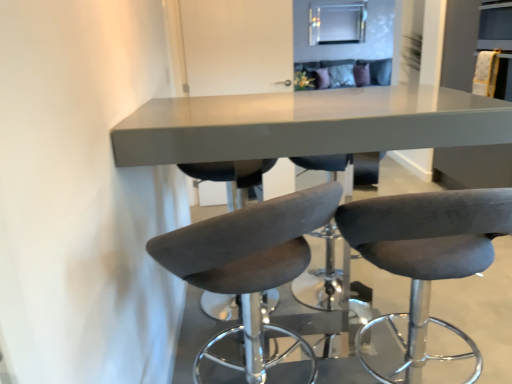
Question: Is dark gray fabric stool at center, arranged as the first chair when viewed from the right, far away from suede-like gray bar stool at center, which ranks as the 2th chair in right-to-left order?

Choices:
 (A) yes
 (B) no

Answer: (B)

Question: Is dark gray fabric stool at center, arranged as the first chair when viewed from the right, oriented away from suede-like gray bar stool at center, which ranks as the 2th chair in right-to-left order?

Choices:
 (A) no
 (B) yes

Answer: (A)

Question: Does dark gray fabric stool at center, arranged as the first chair when viewed from the right, have a lesser height compared to suede-like gray bar stool at center, which ranks as the 2th chair in right-to-left order?

Choices:
 (A) yes
 (B) no

Answer: (A)

Question: Considering the relative sizes of dark gray fabric stool at center, the 2th chair viewed from the left, and suede-like gray bar stool at center, which ranks as the 2th chair in right-to-left order, in the image provided, is dark gray fabric stool at center, the 2th chair viewed from the left, thinner than suede-like gray bar stool at center, which ranks as the 2th chair in right-to-left order,?

Choices:
 (A) no
 (B) yes

Answer: (B)

Question: Would you say suede-like gray bar stool at center, the 1th chair when ordered from left to right, is part of dark gray fabric stool at center, arranged as the first chair when viewed from the right,'s contents?

Choices:
 (A) no
 (B) yes

Answer: (A)

Question: Is dark gray fabric stool at center, arranged as the first chair when viewed from the right, located outside suede-like gray bar stool at center, the 1th chair when ordered from left to right?

Choices:
 (A) no
 (B) yes

Answer: (B)

Question: Does matte gray table at center turn towards suede-like gray bar stool at center, which ranks as the 2th chair in right-to-left order?

Choices:
 (A) no
 (B) yes

Answer: (A)

Question: Is matte gray table at center looking in the opposite direction of suede-like gray bar stool at center, the 1th chair when ordered from left to right?

Choices:
 (A) no
 (B) yes

Answer: (A)

Question: Does matte gray table at center contain suede-like gray bar stool at center, which ranks as the 2th chair in right-to-left order?

Choices:
 (A) yes
 (B) no

Answer: (A)

Question: Are matte gray table at center and suede-like gray bar stool at center, which ranks as the 2th chair in right-to-left order, making contact?

Choices:
 (A) no
 (B) yes

Answer: (A)

Question: From a real-world perspective, is matte gray table at center physically above suede-like gray bar stool at center, which ranks as the 2th chair in right-to-left order?

Choices:
 (A) no
 (B) yes

Answer: (B)

Question: Is matte gray table at center outside suede-like gray bar stool at center, which ranks as the 2th chair in right-to-left order?

Choices:
 (A) yes
 (B) no

Answer: (A)

Question: Does suede-like gray bar stool at center, which ranks as the 2th chair in right-to-left order, have a greater height compared to matte gray table at center?

Choices:
 (A) yes
 (B) no

Answer: (B)